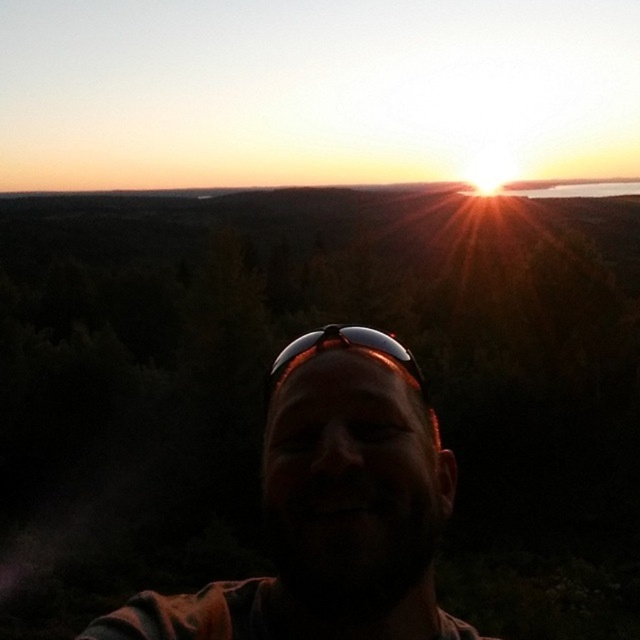
Question: Among these points, which one is farthest from the camera?

Choices:
 (A) (339, 342)
 (B) (337, 545)

Answer: (A)

Question: Is matte black sunglasses at center closer to camera compared to black reflective sunglasses at center?

Choices:
 (A) yes
 (B) no

Answer: (A)

Question: From the image, what is the correct spatial relationship of matte black sunglasses at center in relation to black reflective sunglasses at center?

Choices:
 (A) right
 (B) left

Answer: (B)

Question: Observing the image, what is the correct spatial positioning of matte black sunglasses at center in reference to black reflective sunglasses at center?

Choices:
 (A) below
 (B) above

Answer: (A)

Question: Which point is closer to the camera taking this photo?

Choices:
 (A) (388, 358)
 (B) (333, 364)

Answer: (B)